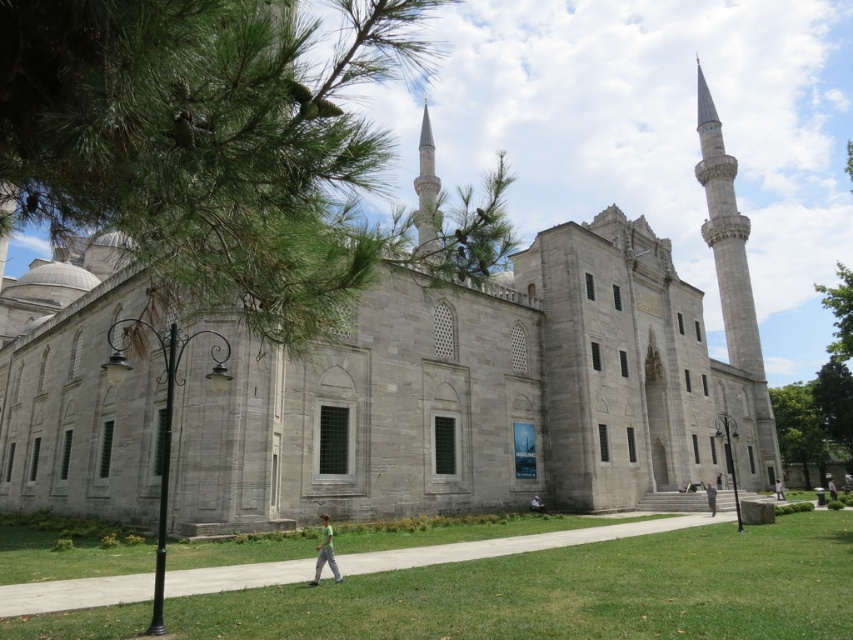
Question: Where is gray stone mosque at center located in relation to green fabric person at lower center in the image?

Choices:
 (A) above
 (B) below

Answer: (A)

Question: Estimate the real-world distances between objects in this image. Which object is farther from the green fabric shirt at lower center?

Choices:
 (A) dark gray fabric at lower right
 (B) green fabric person at center

Answer: (B)

Question: Does dark gray fabric at lower right appear on the right side of green fabric shirt at center?

Choices:
 (A) yes
 (B) no

Answer: (B)

Question: Can you confirm if green leafy tree at upper left is thinner than dark gray fabric at lower right?

Choices:
 (A) yes
 (B) no

Answer: (B)

Question: Considering the real-world distances, which object is closest to the green fabric shirt at lower center?

Choices:
 (A) gray stone mosque at center
 (B) green grass at lower center
 (C) green leafy tree at upper left

Answer: (B)

Question: Which point appears closest to the camera in this image?

Choices:
 (A) (643, 445)
 (B) (781, 492)
 (C) (195, 228)
 (D) (531, 508)

Answer: (C)